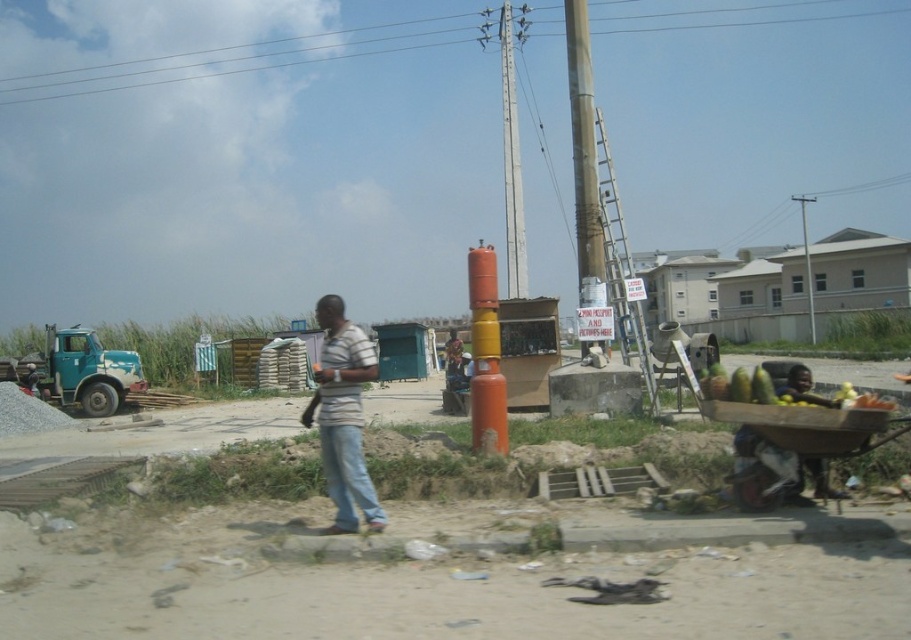
You are a drone operator trying to capture a clear aerial shot of the scene. You need to fly your drone between the brushed metal power line at upper center and the metallic gray telegraph pole at upper right. Which object should you fly closer to in order to avoid collision?

You should fly closer to the metallic gray telegraph pole at upper right because the brushed metal power line at upper center is closer to the drone, so maintaining proximity to the farther pole reduces collision risk.

You are standing at the dirt road in the image. You need to determine which object is taller between the blue denim jeans at center and the metallic gray telegraph pole at upper right. Which one is taller?

The metallic gray telegraph pole at upper right is taller than the blue denim jeans at center.

You are standing at point (x=807, y=272) and want to walk to point (x=334, y=476). Which direction should you move relative to your current position?

You should move forward because point (x=334, y=476) is in front of point (x=807, y=272).